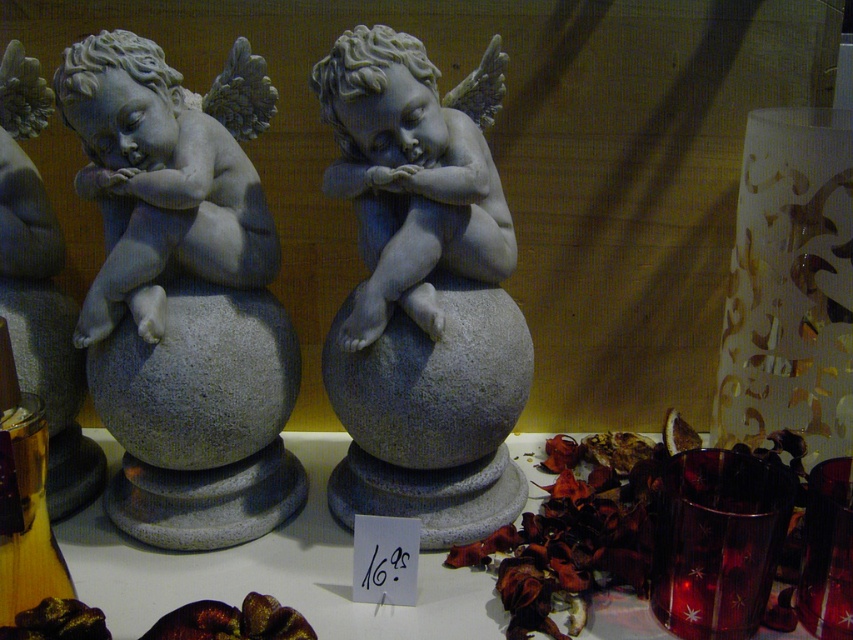
You are an art curator arranging an exhibition. You have a matte stone cherub at center and a wooden bottle at lower left. Which object is placed higher in the image?

The matte stone cherub at center is positioned over the wooden bottle at lower left, meaning it is placed higher than the wooden bottle at lower left.

You are an art curator planning to place a decorative vase between the matte stone cherub at center and the white stone cherub at center. The vase has a diameter of 7 inches. Will there be enough space between the two cherubs to place the vase without moving them?

The distance between the matte stone cherub at center and the white stone cherub at center is 8.14 inches. Since the vase has a diameter of 7 inches, there is sufficient space to place it between them without needing to move the cherubs.

Consider the image. You are an art curator examining two stone cherub sculptures displayed side by side. The matte stone cherub at center and the white stone cherub at center. Which one is the smaller one?

The matte stone cherub at center is smaller than the white stone cherub at center according to the description.